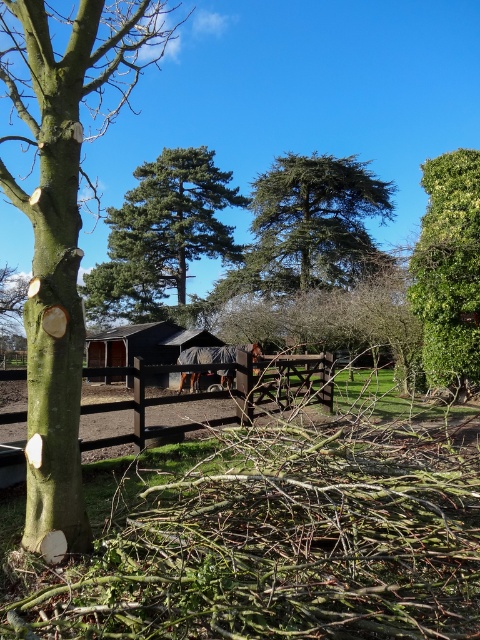
Question: Does brown wooden fence at center have a smaller size compared to dark gray tarpaulin hut at center?

Choices:
 (A) no
 (B) yes

Answer: (B)

Question: Which object is the closest to the green rough bark tree at left?

Choices:
 (A) brown wooden fence at center
 (B) dark gray tarpaulin hut at center
 (C) green textured pine tree at center

Answer: (A)

Question: Is green leafy bush at upper right smaller than dark gray tarpaulin hut at center?

Choices:
 (A) no
 (B) yes

Answer: (B)

Question: Estimate the real-world distances between objects in this image. Which object is closer to the dark gray fabric horse at center?

Choices:
 (A) green leafy bush at upper right
 (B) brown wooden fence at center
 (C) dark gray tarpaulin hut at center

Answer: (B)

Question: Among these points, which one is nearest to the camera?

Choices:
 (A) (188, 355)
 (B) (175, 259)

Answer: (A)

Question: Is green rough bark tree at left behind green textured pine tree at center?

Choices:
 (A) no
 (B) yes

Answer: (A)